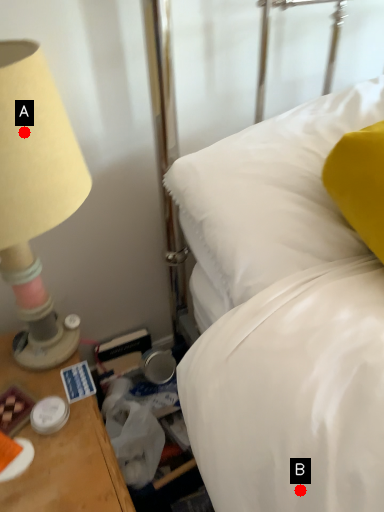
Question: Two points are circled on the image, labeled by A and B beside each circle. Which point is closer to the camera?

Choices:
 (A) A is closer
 (B) B is closer

Answer: (B)